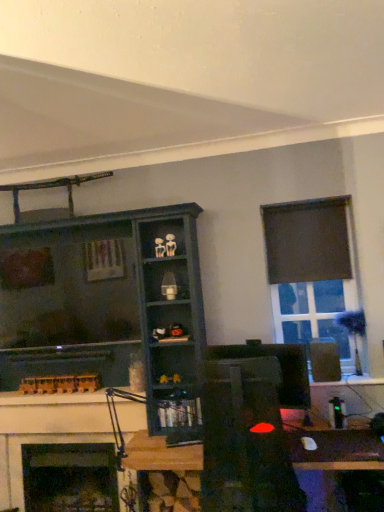
Question: Is black plastic speaker at right looking in the opposite direction of matte black monitor at center?

Choices:
 (A) yes
 (B) no

Answer: (B)

Question: Is black plastic speaker at right outside of matte black monitor at center?

Choices:
 (A) no
 (B) yes

Answer: (B)

Question: From a real-world perspective, is black plastic speaker at right positioned over matte black monitor at center based on gravity?

Choices:
 (A) no
 (B) yes

Answer: (B)

Question: Does black plastic speaker at right appear on the left side of matte black monitor at center?

Choices:
 (A) no
 (B) yes

Answer: (A)

Question: Considering the relative sizes of black plastic speaker at right and matte black monitor at center in the image provided, is black plastic speaker at right smaller than matte black monitor at center?

Choices:
 (A) no
 (B) yes

Answer: (B)

Question: Considering the positions of dark wood shelf at center, positioned as the second shelf in bottom-to-top order, and black fabric curtain at upper right in the image, is dark wood shelf at center, positioned as the second shelf in bottom-to-top order, bigger or smaller than black fabric curtain at upper right?

Choices:
 (A) big
 (B) small

Answer: (A)

Question: From a real-world perspective, relative to black fabric curtain at upper right, is dark wood shelf at center, which is the 2th shelf from right to left, vertically above or below?

Choices:
 (A) above
 (B) below

Answer: (B)

Question: Is dark wood shelf at center, which is the 2th shelf from right to left, inside the boundaries of black fabric curtain at upper right, or outside?

Choices:
 (A) outside
 (B) inside

Answer: (A)

Question: From the image's perspective, is dark wood shelf at center, marked as the first shelf in a top-to-bottom arrangement, located above or below black fabric curtain at upper right?

Choices:
 (A) above
 (B) below

Answer: (B)

Question: Relative to dark wood shelf at center, which is the first shelf in left-to-right order, is black fabric curtain at upper right in front or behind?

Choices:
 (A) behind
 (B) front

Answer: (A)

Question: Is black fabric curtain at upper right bigger or smaller than dark wood shelf at center, marked as the first shelf in a top-to-bottom arrangement?

Choices:
 (A) small
 (B) big

Answer: (A)

Question: From the image's perspective, is black fabric curtain at upper right located above or below dark wood shelf at center, positioned as the second shelf in bottom-to-top order?

Choices:
 (A) above
 (B) below

Answer: (A)

Question: From a real-world perspective, is black fabric curtain at upper right positioned above or below dark wood shelf at center, which is the 2th shelf from right to left?

Choices:
 (A) below
 (B) above

Answer: (B)

Question: In terms of width, does dark matte window at upper right look wider or thinner when compared to dark wood shelf at center, positioned as the second shelf in bottom-to-top order?

Choices:
 (A) thin
 (B) wide

Answer: (A)

Question: Visually, is dark matte window at upper right positioned to the left or to the right of dark wood shelf at center, which is the first shelf in left-to-right order?

Choices:
 (A) right
 (B) left

Answer: (A)